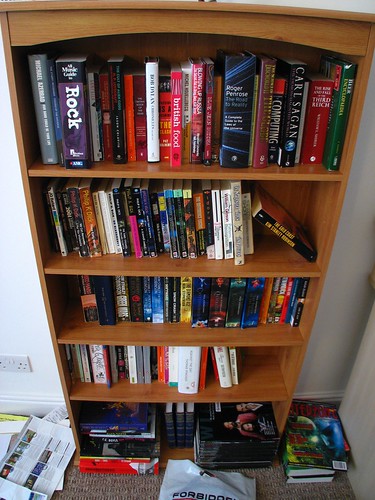
Image resolution: width=375 pixels, height=500 pixels. What are the coordinates of `papers` in the screenshot? It's located at (21, 493), (35, 466), (58, 413), (10, 413), (7, 432).